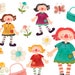
Identify the location of pink basket. (20, 73).